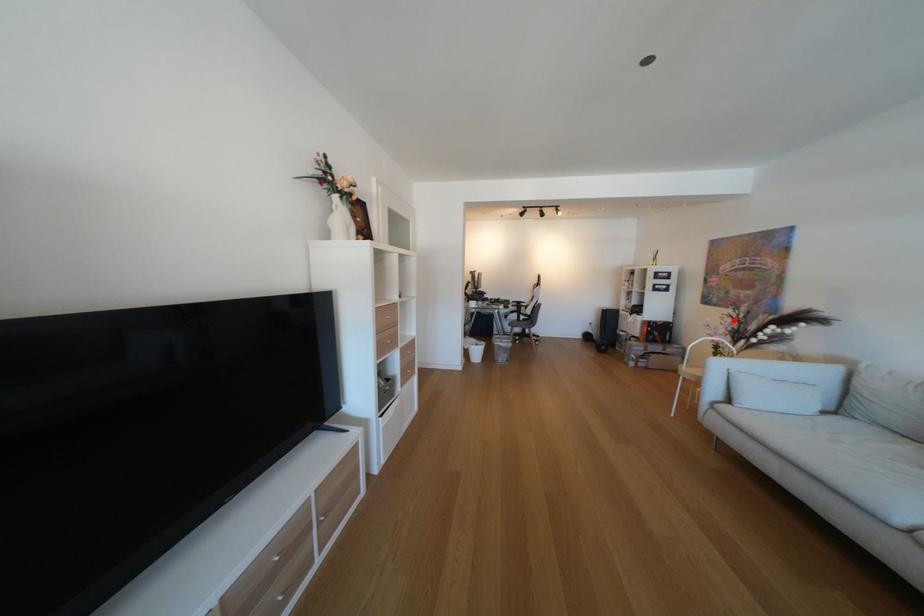
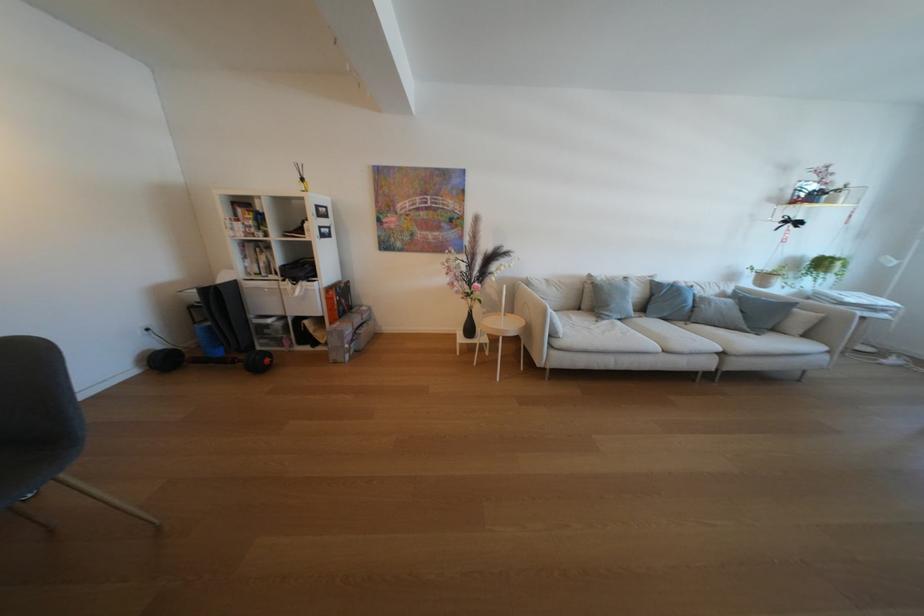
In the second image, find the point that corresponds to the highlighted location in the first image.

(455, 265)